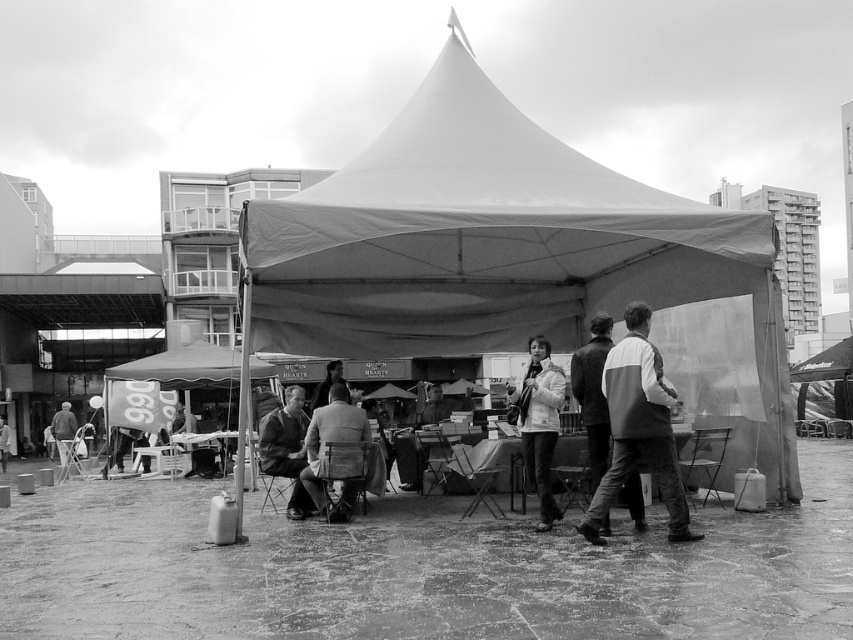
Question: Can you confirm if smooth gray jacket at center is positioned below light gray jacket at lower left?

Choices:
 (A) yes
 (B) no

Answer: (B)

Question: Which of these objects is positioned farthest from the white textured coat at center?

Choices:
 (A) matte gray suit at center
 (B) white fabric tent at center
 (C) smooth leather jacket at center
 (D) smooth gray jacket at center

Answer: (D)

Question: Which point is farther from the camera taking this photo?

Choices:
 (A) (341, 394)
 (B) (532, 458)
 (C) (621, 406)

Answer: (A)

Question: Can you confirm if matte gray suit at center is smaller than smooth gray jacket at center?

Choices:
 (A) yes
 (B) no

Answer: (A)

Question: Can you confirm if white fabric tent at center is positioned above smooth gray jacket at center?

Choices:
 (A) no
 (B) yes

Answer: (B)

Question: Which is nearer to the white fabric tent at center?

Choices:
 (A) white textured coat at center
 (B) matte gray suit at center
 (C) smooth leather jacket at center

Answer: (B)